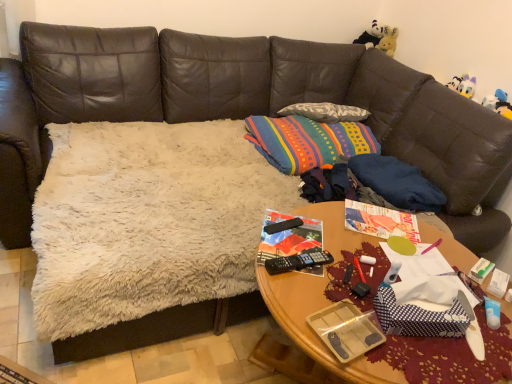
Question: Is black plastic remote control at center completely or partially inside blue dotted paper at center?

Choices:
 (A) yes
 (B) no

Answer: (B)

Question: Are blue dotted paper at center and black plastic remote control at center making contact?

Choices:
 (A) no
 (B) yes

Answer: (A)

Question: Is blue dotted paper at center shorter than black plastic remote control at center?

Choices:
 (A) yes
 (B) no

Answer: (B)

Question: Does blue dotted paper at center appear on the left side of black plastic remote control at center?

Choices:
 (A) no
 (B) yes

Answer: (A)

Question: Can you confirm if blue dotted paper at center is positioned to the right of black plastic remote control at center?

Choices:
 (A) no
 (B) yes

Answer: (B)

Question: From a real-world perspective, relative to black plastic remote control at center, is multicolored woven throw pillow at center vertically above or below?

Choices:
 (A) above
 (B) below

Answer: (B)

Question: Looking at their shapes, would you say multicolored woven throw pillow at center is wider or thinner than black plastic remote control at center?

Choices:
 (A) thin
 (B) wide

Answer: (B)

Question: From the image's perspective, is multicolored woven throw pillow at center located above or below black plastic remote control at center?

Choices:
 (A) above
 (B) below

Answer: (A)

Question: Does point (263, 152) appear closer or farther from the camera than point (270, 226)?

Choices:
 (A) closer
 (B) farther

Answer: (B)

Question: Is black plastic remote control at center spatially inside plush white bear at upper right, the 1th toy when ordered from top to bottom, or outside of it?

Choices:
 (A) inside
 (B) outside

Answer: (B)

Question: Is black plastic remote control at center wider or thinner than plush white bear at upper right, acting as the second toy starting from the front?

Choices:
 (A) wide
 (B) thin

Answer: (B)

Question: From the image's perspective, is black plastic remote control at center located above or below plush white bear at upper right, acting as the first toy starting from the back?

Choices:
 (A) below
 (B) above

Answer: (A)

Question: From their relative heights in the image, would you say black plastic remote control at center is taller or shorter than plush white bear at upper right, acting as the second toy starting from the front?

Choices:
 (A) tall
 (B) short

Answer: (B)

Question: From a real-world perspective, is woodenobject at center physically located above or below black plastic remote control at center?

Choices:
 (A) above
 (B) below

Answer: (B)

Question: Is woodenobject at center in front of or behind black plastic remote control at center in the image?

Choices:
 (A) behind
 (B) front

Answer: (B)